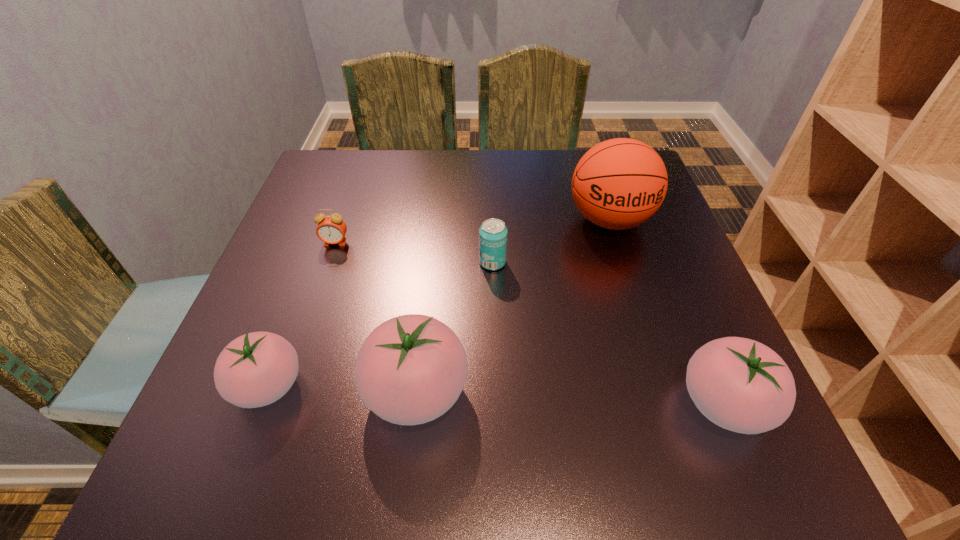
In order to click on free space located 0.120m on the left of the rightmost tomato in this screenshot , I will do `click(605, 404)`.

You are a GUI agent. You are given a task and a screenshot of the screen. Output one action in this format:
    pyautogui.click(x=<x>, y=<y>)
    Task: Click on the blank space located on the left of the third farthest object
    This screenshot has width=960, height=540.
    Given the screenshot: What is the action you would take?
    pyautogui.click(x=400, y=262)

In order to click on vacant space positioned 0.350m on the side with logo of the basketball in this screenshot , I will do `click(663, 388)`.

Find the location of a particular element. The height and width of the screenshot is (540, 960). vacant region located on the face of the alarm clock is located at coordinates (300, 346).

This screenshot has height=540, width=960. I want to click on object that is at the far edge, so (618, 184).

I want to click on tomato located in the left edge section of the desktop, so click(256, 369).

The image size is (960, 540). Find the location of `alarm clock at the left edge`. alarm clock at the left edge is located at coordinates 331,229.

Where is `tomato positioned at the right edge`? This screenshot has width=960, height=540. tomato positioned at the right edge is located at coordinates (739, 384).

Where is `basketball situated at the right edge`? Image resolution: width=960 pixels, height=540 pixels. basketball situated at the right edge is located at coordinates (618, 184).

The height and width of the screenshot is (540, 960). In order to click on object that is at the near left corner in this screenshot , I will do `click(256, 369)`.